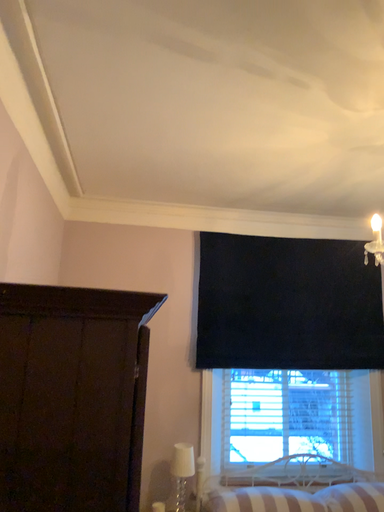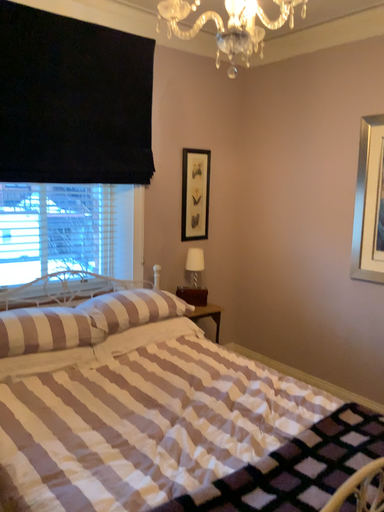
Question: How did the camera likely rotate when shooting the video?

Choices:
 (A) rotated downward
 (B) rotated upward

Answer: (A)